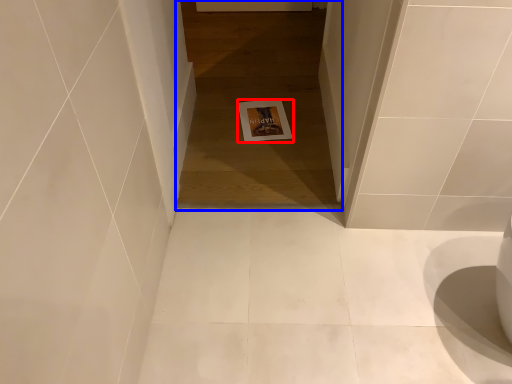
Question: Which object appears closest to the camera in this image, postcard (highlighted by a red box) or passage (highlighted by a blue box)?

Choices:
 (A) postcard
 (B) passage

Answer: (B)